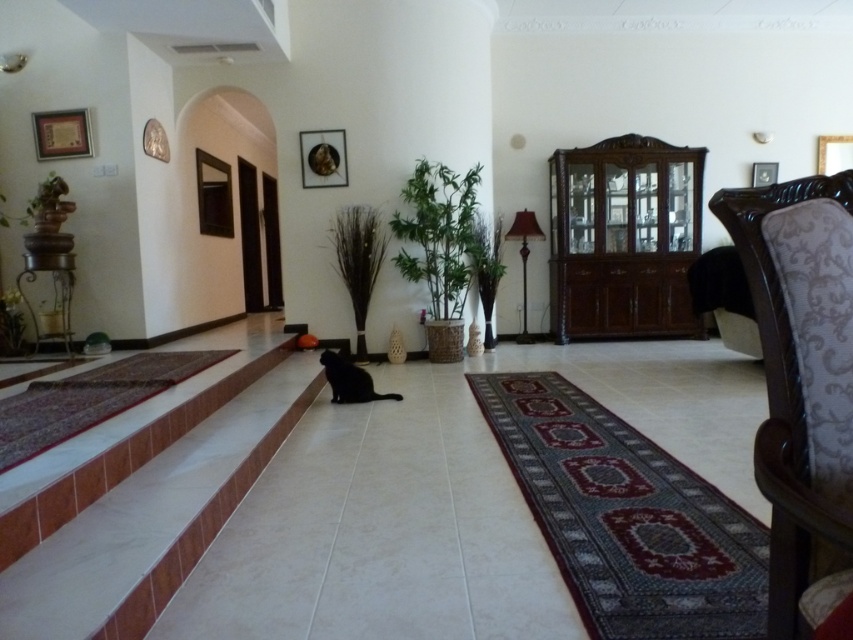
You are standing in the living room and want to place a 1.2 meter tall plant stand between the white tile stairs at center and the dark wood cabinet at center. Based on their heights, will the plant stand fit without exceeding the height of either object?

The white tile stairs at center is shorter than the dark wood cabinet at center. Since the plant stand is 1.2 meters tall, it may exceed the height of the white tile stairs at center. Therefore, the plant stand might not fit without being taller than the stairs.

You are a guest entering the living room and see the white tile stairs at center and the black matte cat at center. Which object takes up more space in the room?

The white tile stairs at center is larger in size than the black matte cat at center, so the white tile stairs at center takes up more space in the room.